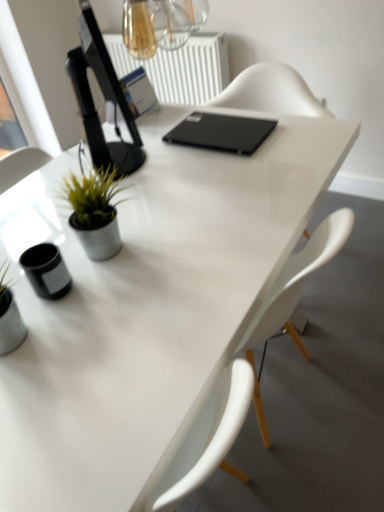
This screenshot has height=512, width=384. Identify the location of vacant space in front of black matte laptop at center. click(225, 169).